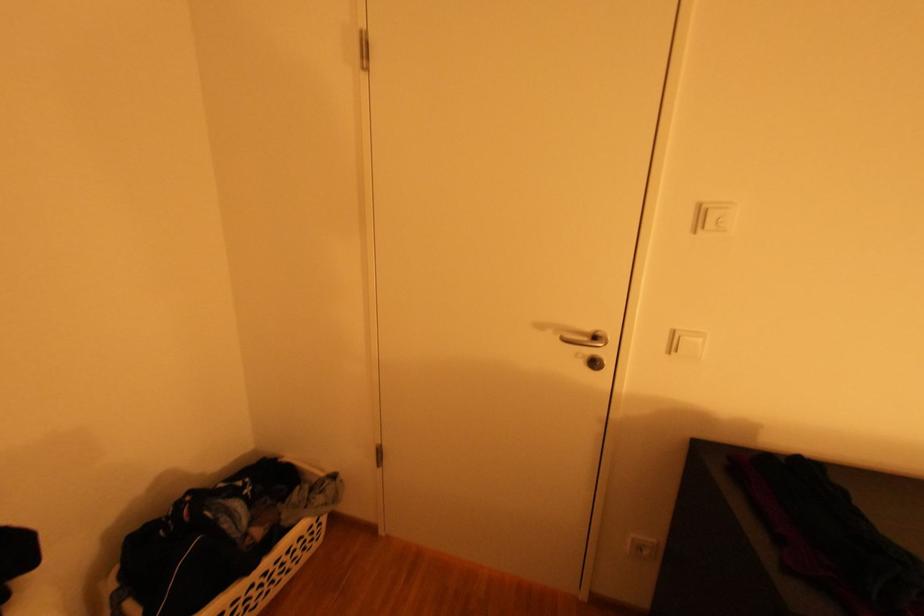
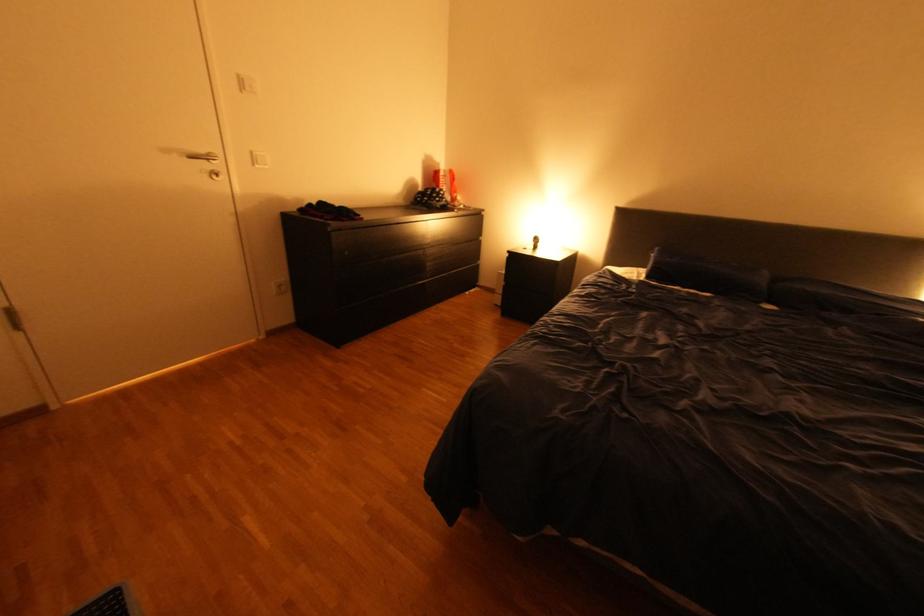
Locate, in the second image, the point that corresponds to point 599,330 in the first image.

(213, 151)